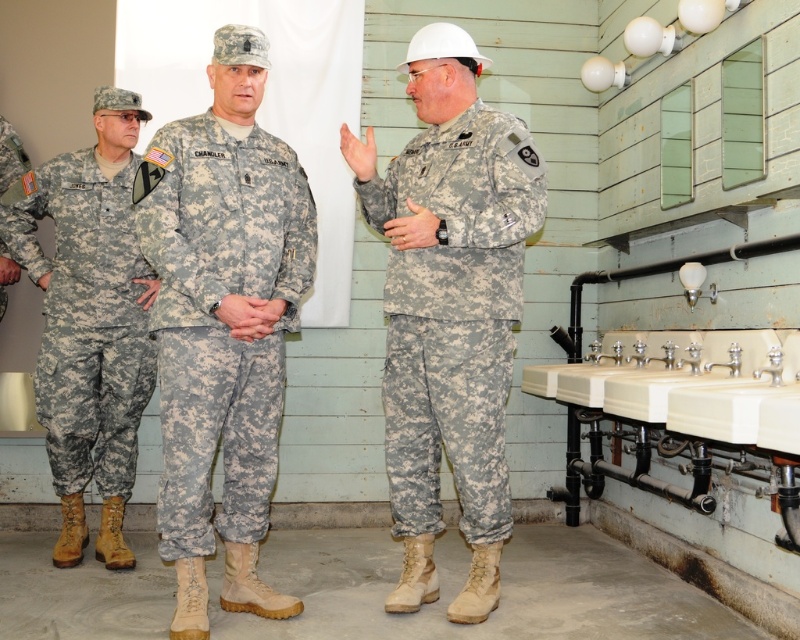
Question: Based on their relative distances, which object is nearer to the camouflage fabric pants at left?

Choices:
 (A) white ceramic sink at lower right
 (B) camouflage fabric pants at center
 (C) camouflage fabric uniform at center

Answer: (B)

Question: Which of the following is the closest to the observer?

Choices:
 (A) camouflage fabric pants at center
 (B) white ceramic sink at lower right
 (C) camouflage fabric pants at left
 (D) camouflage fabric uniform at center

Answer: (B)

Question: Is camouflage fabric pants at center positioned before camouflage fabric uniform at center?

Choices:
 (A) no
 (B) yes

Answer: (B)

Question: Does camouflage fabric pants at center have a lesser width compared to camouflage fabric uniform at center?

Choices:
 (A) yes
 (B) no

Answer: (A)

Question: Which point appears farthest from the camera in this image?

Choices:
 (A) (61, 451)
 (B) (440, 412)

Answer: (A)

Question: Does camouflage fabric uniform at center have a lesser width compared to white ceramic sink at lower right?

Choices:
 (A) no
 (B) yes

Answer: (B)